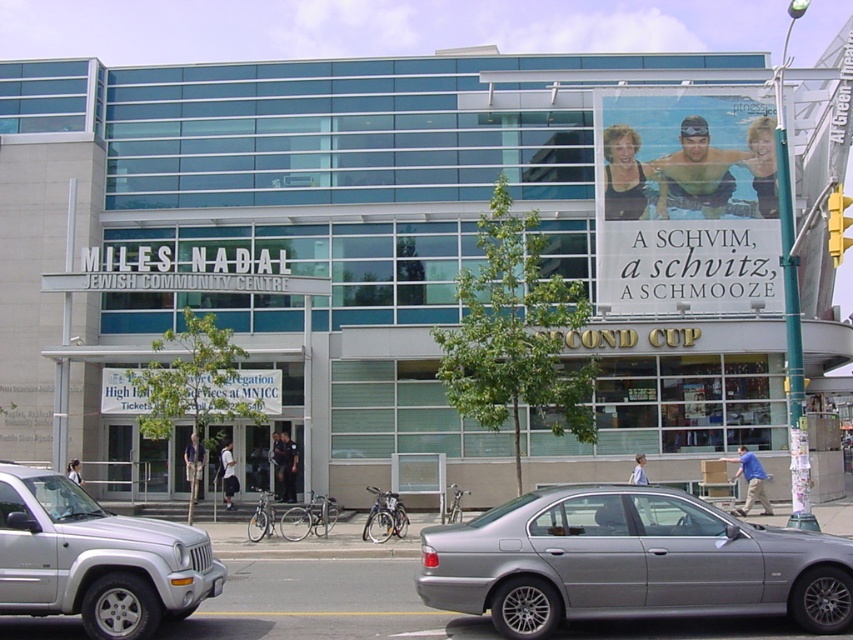
Between silver metallic sedan at center and matte plastic sign at upper right, which one appears on the right side from the viewer's perspective?

From the viewer's perspective, matte plastic sign at upper right appears more on the right side.

Is silver metallic sedan at center above matte plastic sign at upper right?

Incorrect, silver metallic sedan at center is not positioned above matte plastic sign at upper right.

Is point (468, 557) closer to camera compared to point (701, 88)?

Yes, point (468, 557) is in front of point (701, 88).

Locate an element on the screen. silver metallic sedan at center is located at coordinates (630, 563).

Locate an element on the screen. This screenshot has height=640, width=853. silver metallic sedan at center is located at coordinates (630, 563).

Between point (711, 122) and point (35, 554), which one is positioned behind?

The point (711, 122) is behind.

Can you confirm if matte plastic sign at upper right is shorter than silver metallic suv at lower left?

No, matte plastic sign at upper right is not shorter than silver metallic suv at lower left.

I want to click on matte plastic sign at upper right, so click(x=686, y=200).

Where is `matte plastic sign at upper right`? Image resolution: width=853 pixels, height=640 pixels. matte plastic sign at upper right is located at coordinates (686, 200).